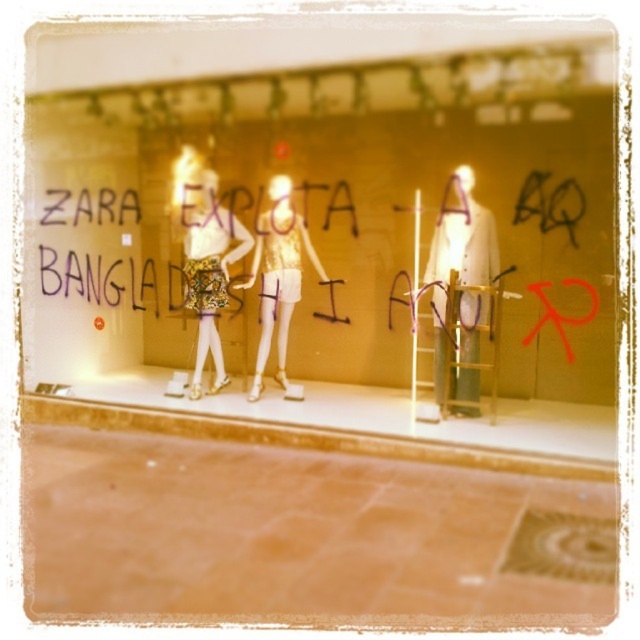
Is point (218, 342) positioned in front of point (208, 285)?

No, (218, 342) is behind (208, 285).

Between point (116, 221) and point (211, 276), which one is positioned behind?

The point (116, 221) is behind.

Which is in front, point (541, 202) or point (214, 282)?

Point (541, 202) is more forward.

Find the location of a particular element. The image size is (640, 640). matte white mannequin at center is located at coordinates (337, 244).

Does matte white mannequin at center lie behind metallic gold dress at center?

No, matte white mannequin at center is in front of metallic gold dress at center.

Describe the element at coordinates (337, 244) in the screenshot. I see `matte white mannequin at center` at that location.

Locate an element on the screen. The width and height of the screenshot is (640, 640). matte white mannequin at center is located at coordinates (x=337, y=244).

Can you confirm if matte white mannequin at center is positioned above white fabric coat at center?

Indeed, matte white mannequin at center is positioned over white fabric coat at center.

Is matte white mannequin at center taller than white fabric coat at center?

Yes.

The image size is (640, 640). In order to click on matte white mannequin at center in this screenshot , I will do `click(337, 244)`.